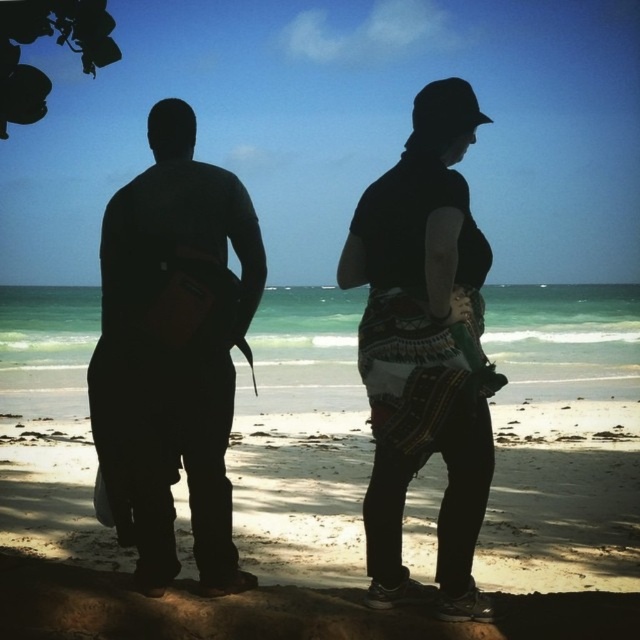
Question: Is black matte bag at left to the right of black textured fabric skirt at center from the viewer's perspective?

Choices:
 (A) yes
 (B) no

Answer: (B)

Question: Can you confirm if smooth sand at center is positioned to the right of black textured fabric skirt at center?

Choices:
 (A) no
 (B) yes

Answer: (A)

Question: Which of the following is the closest to the observer?

Choices:
 (A) (483, 502)
 (B) (451, 588)
 (C) (433, 624)
 (D) (116, 352)

Answer: (C)

Question: Which of these objects is positioned closest to the smooth sand at center?

Choices:
 (A) black matte bag at left
 (B) silhouette fabric at center

Answer: (A)

Question: Which point is farther to the camera?

Choices:
 (A) (220, 246)
 (B) (122, 522)
 (C) (465, 460)

Answer: (A)

Question: Does smooth sand at center appear under black matte bag at left?

Choices:
 (A) yes
 (B) no

Answer: (A)